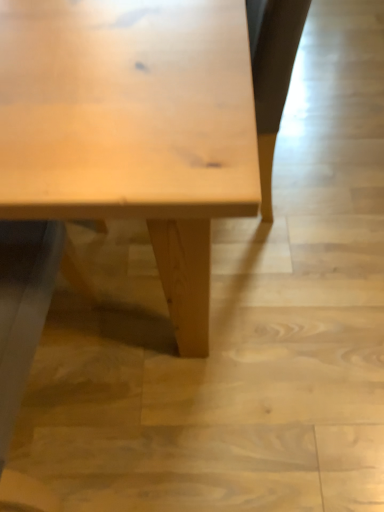
Where is `vacant space in matte wood table at center (from a real-world perspective)`? vacant space in matte wood table at center (from a real-world perspective) is located at coordinates (87, 347).